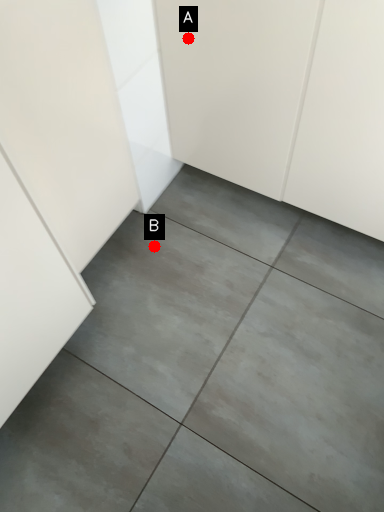
Question: Two points are circled on the image, labeled by A and B beside each circle. Which point appears closest to the camera in this image?

Choices:
 (A) A is closer
 (B) B is closer

Answer: (A)